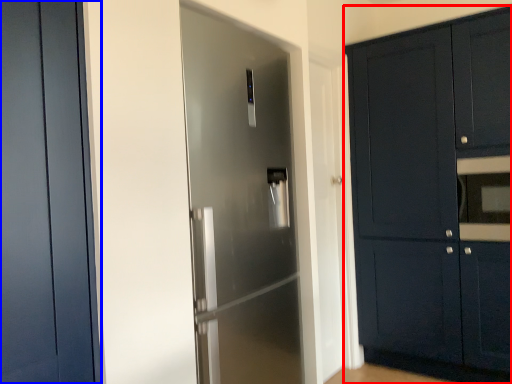
Question: Which object appears farthest to the camera in this image, cabinetry (highlighted by a red box) or door (highlighted by a blue box)?

Choices:
 (A) cabinetry
 (B) door

Answer: (A)